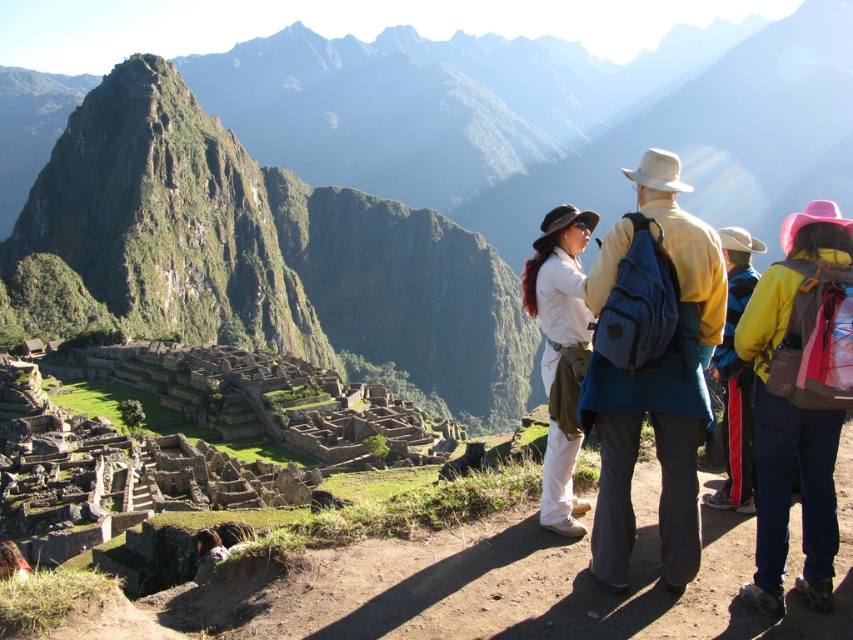
Which is in front, point (581, 301) or point (727, 310)?

Positioned in front is point (727, 310).

Is point (560, 285) behind point (740, 250)?

That is False.

Who is more forward, (x=546, y=472) or (x=740, y=310)?

Point (x=546, y=472) is more forward.

This screenshot has width=853, height=640. Find the location of `white matte shirt at center`. white matte shirt at center is located at coordinates (560, 353).

This screenshot has height=640, width=853. I want to click on yellow fabric jacket at center right, so click(x=787, y=458).

Can you confirm if yellow fabric jacket at center right is positioned below white matte shirt at center?

Incorrect, yellow fabric jacket at center right is not positioned below white matte shirt at center.

Does point (822, 580) come in front of point (567, 337)?

Yes.

Locate an element on the screen. yellow fabric jacket at center right is located at coordinates (787, 458).

Is matte blue backpack at center smaller than white matte shirt at center?

No.

Is matte blue backpack at center shorter than white matte shirt at center?

In fact, matte blue backpack at center may be taller than white matte shirt at center.

Is point (666, 465) more distant than point (550, 438)?

That is False.

The image size is (853, 640). In order to click on matte blue backpack at center in this screenshot , I will do `click(692, 355)`.